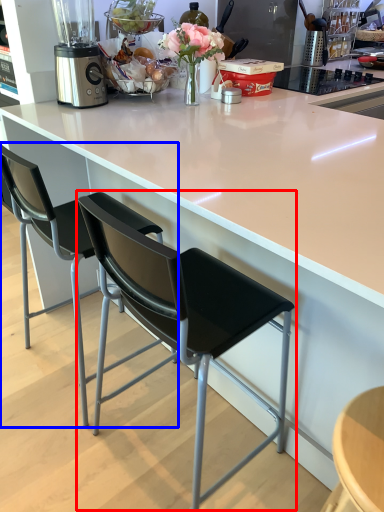
Question: Which of the following is the closest to the observer, chair (highlighted by a red box) or chair (highlighted by a blue box)?

Choices:
 (A) chair
 (B) chair

Answer: (A)